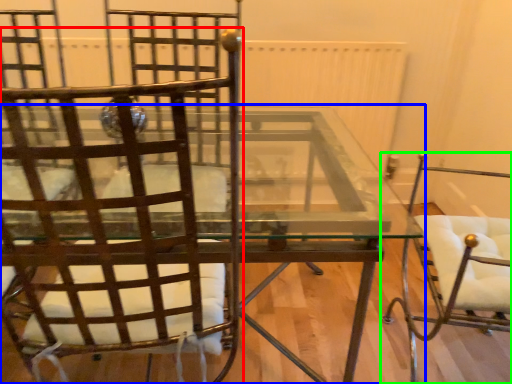
Question: Estimate the real-world distances between objects in this image. Which object is closer to chair (highlighted by a red box), table (highlighted by a blue box) or chair (highlighted by a green box)?

Choices:
 (A) table
 (B) chair

Answer: (A)